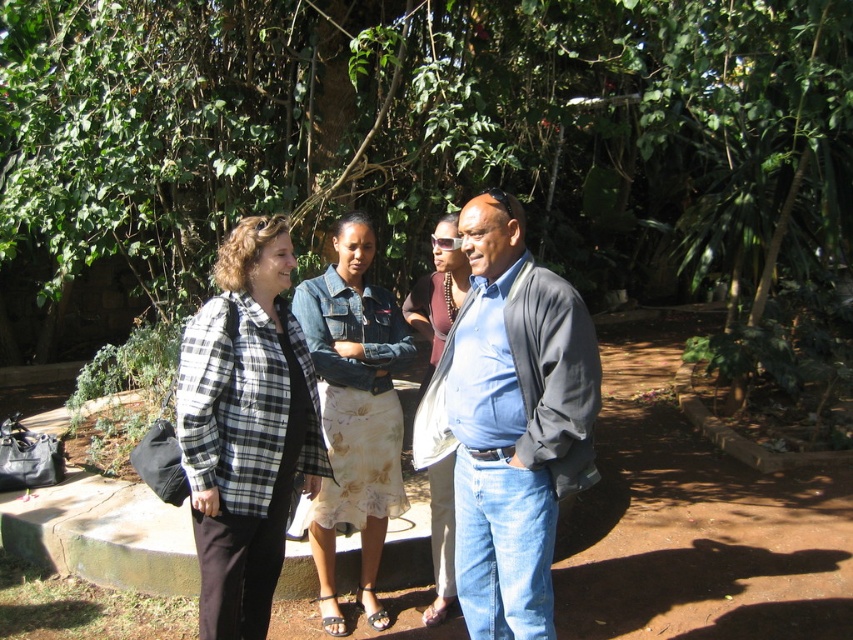
Can you confirm if green leafy tree at center is smaller than plaid shirt at left?

Incorrect, green leafy tree at center is not smaller in size than plaid shirt at left.

From the picture: Between green leafy tree at center and plaid shirt at left, which one appears on the left side from the viewer's perspective?

plaid shirt at left

The width and height of the screenshot is (853, 640). Describe the element at coordinates (428, 131) in the screenshot. I see `green leafy tree at center` at that location.

You are a GUI agent. You are given a task and a screenshot of the screen. Output one action in this format:
    pyautogui.click(x=<x>, y=<y>)
    Task: Click on the green leafy tree at center
    
    Given the screenshot: What is the action you would take?
    pyautogui.click(x=428, y=131)

Is plaid shirt at left smaller than denim skirt at center?

No.

Does point (241, 540) come behind point (436, 232)?

That is False.

What do you see at coordinates (245, 428) in the screenshot?
I see `plaid shirt at left` at bounding box center [245, 428].

Find the location of a particular element. plaid shirt at left is located at coordinates (245, 428).

Is point (265, 29) less distant than point (369, 374)?

No, (265, 29) is behind (369, 374).

Looking at this image, can you confirm if green leafy tree at center is bigger than denim jacket at center?

Indeed, green leafy tree at center has a larger size compared to denim jacket at center.

Is point (222, 189) behind point (369, 262)?

Yes, point (222, 189) is farther from viewer.

Image resolution: width=853 pixels, height=640 pixels. In order to click on green leafy tree at center in this screenshot , I will do `click(428, 131)`.